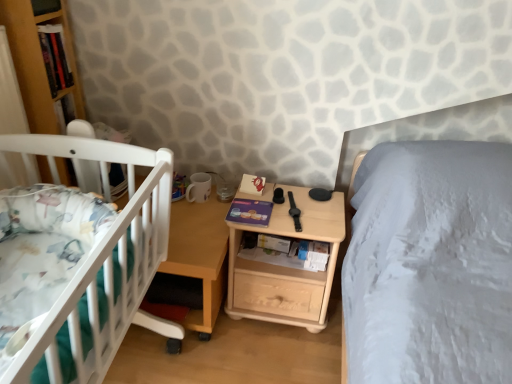
Question: Is white plastic crib at left thinner than natural wood nightstand at center?

Choices:
 (A) yes
 (B) no

Answer: (B)

Question: Is white plastic crib at left positioned beyond the bounds of natural wood nightstand at center?

Choices:
 (A) yes
 (B) no

Answer: (A)

Question: From the image's perspective, is white plastic crib at left under natural wood nightstand at center?

Choices:
 (A) no
 (B) yes

Answer: (A)

Question: Is white plastic crib at left positioned behind natural wood nightstand at center?

Choices:
 (A) yes
 (B) no

Answer: (B)

Question: Considering the relative sizes of white plastic crib at left and natural wood nightstand at center in the image provided, is white plastic crib at left wider than natural wood nightstand at center?

Choices:
 (A) yes
 (B) no

Answer: (A)

Question: Can you confirm if white plastic crib at left is smaller than natural wood nightstand at center?

Choices:
 (A) yes
 (B) no

Answer: (A)

Question: From the image's perspective, is natural wood nightstand at center beneath wooden table at center?

Choices:
 (A) yes
 (B) no

Answer: (B)

Question: Is natural wood nightstand at center outside of wooden table at center?

Choices:
 (A) no
 (B) yes

Answer: (B)

Question: From the image's perspective, is natural wood nightstand at center above wooden table at center?

Choices:
 (A) yes
 (B) no

Answer: (A)

Question: Considering the relative sizes of natural wood nightstand at center and wooden table at center in the image provided, is natural wood nightstand at center taller than wooden table at center?

Choices:
 (A) no
 (B) yes

Answer: (B)

Question: Is natural wood nightstand at center oriented away from wooden table at center?

Choices:
 (A) no
 (B) yes

Answer: (A)

Question: From a real-world perspective, is natural wood nightstand at center below wooden table at center?

Choices:
 (A) yes
 (B) no

Answer: (B)

Question: Can you confirm if matte purple book at center, which appears as the second book when viewed from the left, is bigger than hardcover book at upper left, the 1th book positioned from the left?

Choices:
 (A) no
 (B) yes

Answer: (A)